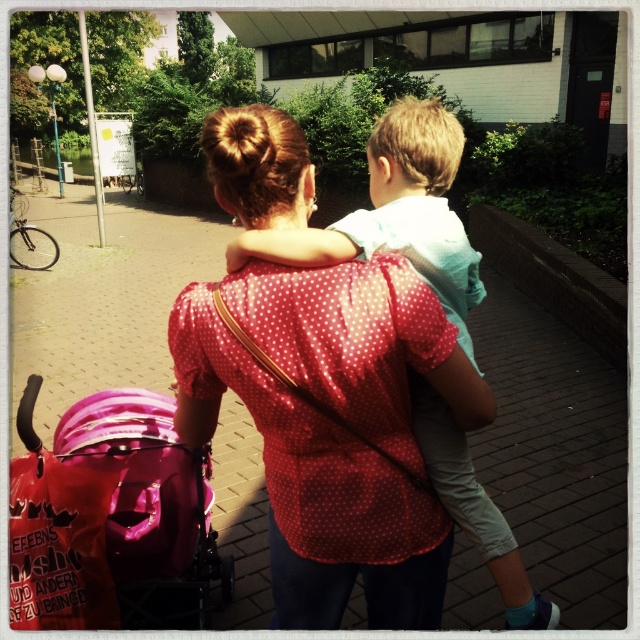
Does brick pavement at center appear on the right side of light blue cotton shirt at upper center?

No, brick pavement at center is not to the right of light blue cotton shirt at upper center.

Is brick pavement at center shorter than light blue cotton shirt at upper center?

No, brick pavement at center is not shorter than light blue cotton shirt at upper center.

Describe the element at coordinates (556, 452) in the screenshot. I see `brick pavement at center` at that location.

The image size is (640, 640). Find the location of `brick pavement at center`. brick pavement at center is located at coordinates (556, 452).

Who is more distant from viewer, [58,536] or [419,404]?

Point [58,536]

Locate an element on the screen. The width and height of the screenshot is (640, 640). pink fabric baby carriage at lower left is located at coordinates (112, 518).

Looking at this image, who is more distant from viewer, (68, 557) or (461, 525)?

The point (68, 557) is behind.

The height and width of the screenshot is (640, 640). In order to click on pink fabric baby carriage at lower left in this screenshot , I will do 112,518.

Which is behind, point (90, 355) or point (109, 576)?

The point (90, 355) is more distant.

Which is in front, point (470, 330) or point (150, 502)?

Point (150, 502) is in front.

What do you see at coordinates (556, 452) in the screenshot? I see `brick pavement at center` at bounding box center [556, 452].

I want to click on brick pavement at center, so click(556, 452).